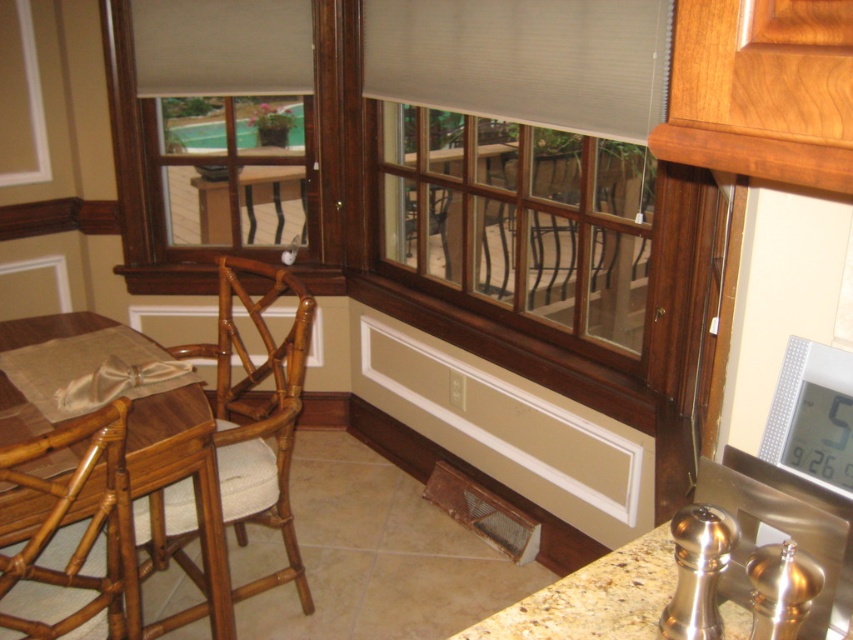
You are a person sitting on the natural wood chair at left. You want to look out through the matte wood window at center. Can you see the window from your current position?

The matte wood window at center is positioned over the natural wood chair at left, so yes, you can see the window from your current position as it is above the chair.

You are setting up a small kitchen display and need to place both the granite countertop at lower right and the bamboo table at left. Given their sizes, which one should you choose if you want to use the larger surface for arranging items?

You should choose the bamboo table at left because it has a larger surface compared to the granite countertop at lower right.

You are arranging a small plant on the countertop between the matte wood window at center and the natural wood chair at left. Which side of the plant should face the window to ensure it gets sunlight?

The plant should face the matte wood window at center since it is positioned to the right of the natural wood chair at left, placing it closer to the window for sunlight exposure.